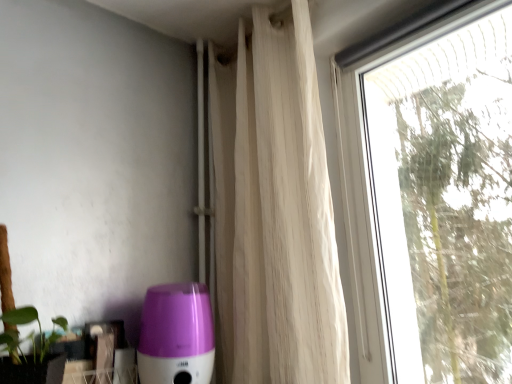
Question: Does white sheer curtain at upper right appear on the left side of transparent glass window at right?

Choices:
 (A) yes
 (B) no

Answer: (A)

Question: Could you tell me if white sheer curtain at upper right is facing transparent glass window at right?

Choices:
 (A) no
 (B) yes

Answer: (A)

Question: Is white sheer curtain at upper right not near transparent glass window at right?

Choices:
 (A) no
 (B) yes

Answer: (A)

Question: From the image's perspective, is white sheer curtain at upper right under transparent glass window at right?

Choices:
 (A) yes
 (B) no

Answer: (B)

Question: Is white sheer curtain at upper right wider than transparent glass window at right?

Choices:
 (A) no
 (B) yes

Answer: (B)

Question: Considering the positions of transparent glass window at right and purple glossy humidifier at lower left in the image, is transparent glass window at right bigger or smaller than purple glossy humidifier at lower left?

Choices:
 (A) small
 (B) big

Answer: (B)

Question: Considering the positions of transparent glass window at right and purple glossy humidifier at lower left in the image, is transparent glass window at right taller or shorter than purple glossy humidifier at lower left?

Choices:
 (A) tall
 (B) short

Answer: (A)

Question: Is transparent glass window at right wider or thinner than purple glossy humidifier at lower left?

Choices:
 (A) wide
 (B) thin

Answer: (B)

Question: Is point (454, 152) closer or farther from the camera than point (180, 365)?

Choices:
 (A) farther
 (B) closer

Answer: (A)

Question: Visually, is purple glossy humidifier at lower left positioned to the left or to the right of transparent glass window at right?

Choices:
 (A) left
 (B) right

Answer: (A)

Question: Considering the positions of point (144, 324) and point (453, 49), is point (144, 324) closer or farther from the camera than point (453, 49)?

Choices:
 (A) farther
 (B) closer

Answer: (B)

Question: Considering the positions of purple glossy humidifier at lower left and transparent glass window at right in the image, is purple glossy humidifier at lower left bigger or smaller than transparent glass window at right?

Choices:
 (A) small
 (B) big

Answer: (A)

Question: From a real-world perspective, relative to transparent glass window at right, is purple glossy humidifier at lower left vertically above or below?

Choices:
 (A) above
 (B) below

Answer: (B)

Question: From a real-world perspective, is transparent glass window at right above or below white sheer curtain at upper right?

Choices:
 (A) above
 (B) below

Answer: (B)

Question: Relative to white sheer curtain at upper right, is transparent glass window at right in front or behind?

Choices:
 (A) front
 (B) behind

Answer: (A)